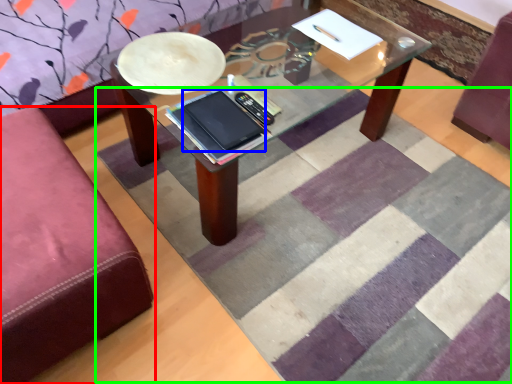
Question: Which is farther away from studio couch (highlighted by a red box)? tablet computer (highlighted by a blue box) or mat (highlighted by a green box)?

Choices:
 (A) tablet computer
 (B) mat

Answer: (B)